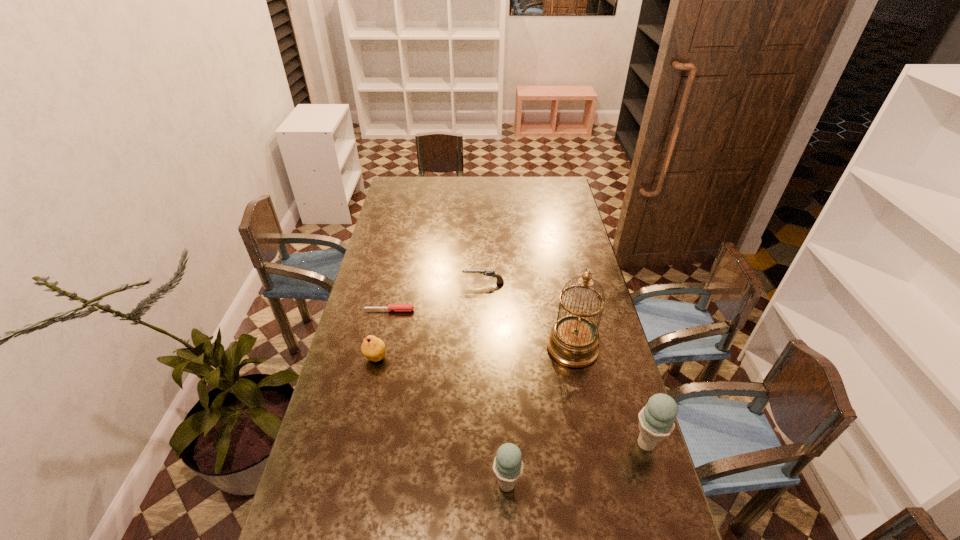
At what (x,y) coordinates should I click in order to perform the action: click on the shortest object. Please return your answer as a coordinate pair (x, y). The image size is (960, 540). Looking at the image, I should click on (396, 307).

Identify the location of vacant space located 0.350m on the left of the left ice cream. The image size is (960, 540). (358, 484).

Find the location of a particular element. The height and width of the screenshot is (540, 960). free region located 0.300m on the left of the right ice cream is located at coordinates (523, 444).

The width and height of the screenshot is (960, 540). Identify the location of vacant area situated aiming along the barrel of the farthest object. (402, 284).

This screenshot has width=960, height=540. In order to click on free space located 0.260m aiming along the barrel of the farthest object in this screenshot , I will do `click(397, 284)`.

Locate an element on the screen. The width and height of the screenshot is (960, 540). vacant space located 0.170m aiming along the barrel of the farthest object is located at coordinates (420, 284).

Identify the location of vacant space situated on the back of the third shortest object. (385, 313).

You are a GUI agent. You are given a task and a screenshot of the screen. Output one action in this format:
    pyautogui.click(x=<x>, y=<y>)
    Task: Click on the free region located 0.310m with an open door on the birdcage
    This screenshot has width=960, height=540.
    Given the screenshot: What is the action you would take?
    pyautogui.click(x=456, y=348)

In order to click on free spot located 0.070m with an open door on the birdcage in this screenshot , I will do (526, 348).

The image size is (960, 540). Find the location of `free space located with an open door on the birdcage`. free space located with an open door on the birdcage is located at coordinates (453, 348).